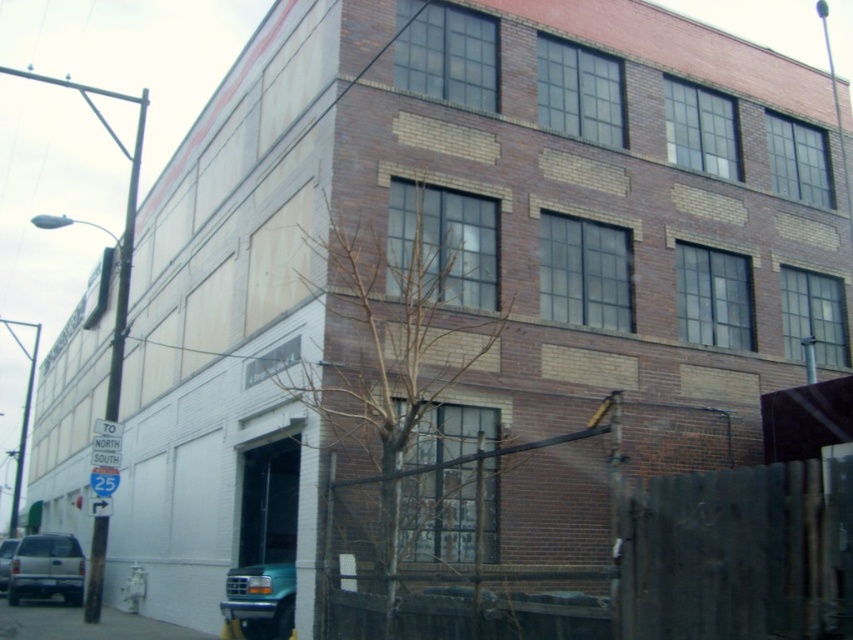
You are a delivery driver who needs to park your vehicle near the teal matte truck at lower left without blocking the brown wooden fence at lower right. Given their sizes, is this possible?

The brown wooden fence at lower right occupies less space than the teal matte truck at lower left, so yes, it is possible to park the vehicle near the teal matte truck at lower left without blocking the brown wooden fence at lower right since the fence requires less area.

You are a delivery driver who needs to park your truck next to the teal matte truck at lower left without hitting the brown wooden fence at lower right. Based on the scene, can you safely park there considering the space between them?

The brown wooden fence at lower right is thinner than the teal matte truck at lower left. Since the fence is thinner, there should be enough space to park the truck next to the teal matte truck at lower left without hitting the fence.

You are standing in front of the building and notice the bare branches at center and the teal matte truck at lower left. Which object is nearer to you?

The bare branches at center are closer to the viewer than the teal matte truck at lower left.